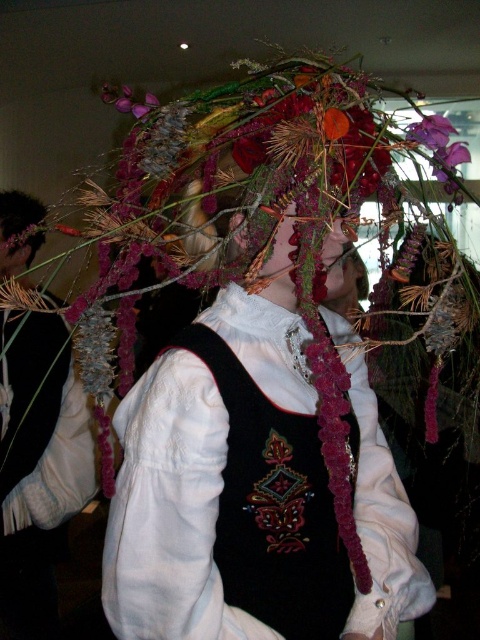
You are a photographer trying to capture the cultural attire in the image. You notice two elements of the outfit that are central to the composition. Which of the two items, the burgundy fabric headdress at center or the purple fabric flower at upper center, is positioned higher in the image?

The purple fabric flower at upper center is positioned higher in the image than the burgundy fabric headdress at center.